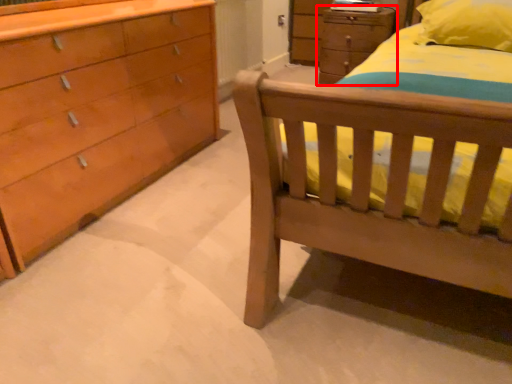
Question: Where is chest of drawers (annotated by the red box) located in relation to pillow in the image?

Choices:
 (A) right
 (B) left

Answer: (B)